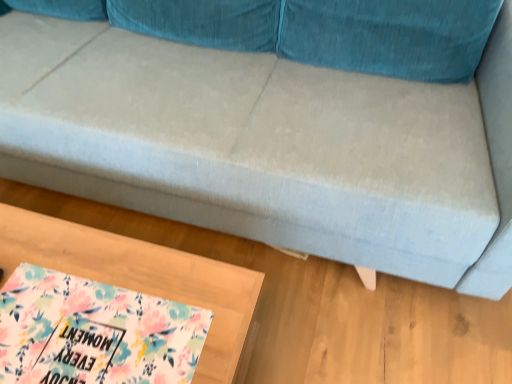
What is the approximate width of floral fabric table at lower left?

15.31 inches.

Where is `floral fabric table at lower left`? This screenshot has height=384, width=512. floral fabric table at lower left is located at coordinates (141, 276).

The image size is (512, 384). What do you see at coordinates (141, 276) in the screenshot? I see `floral fabric table at lower left` at bounding box center [141, 276].

Image resolution: width=512 pixels, height=384 pixels. I want to click on floral fabric table at lower left, so pyautogui.click(x=141, y=276).